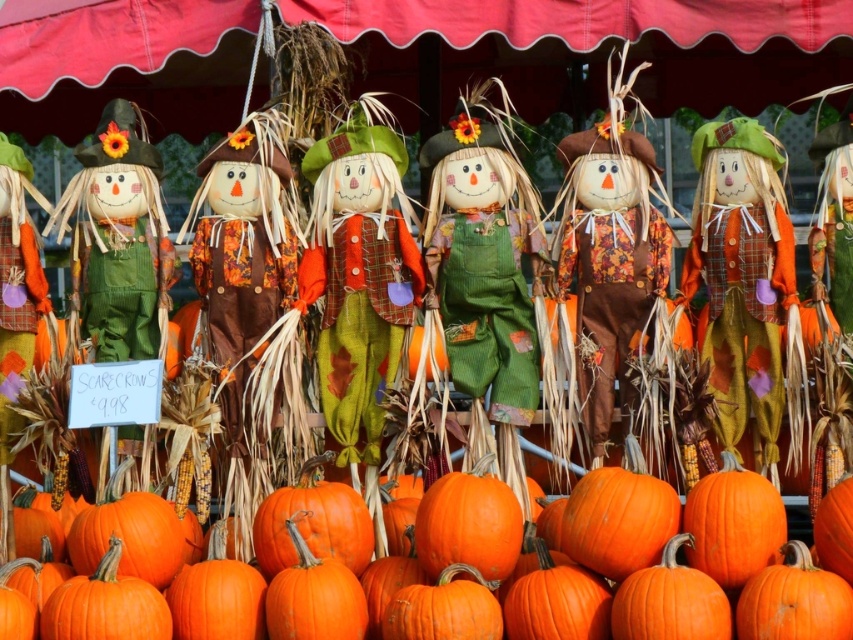
Which is more to the left, green corduroy scarecrow at center or matte orange scarecrow at center?

Positioned to the left is green corduroy scarecrow at center.

In the scene shown: Is green corduroy scarecrow at center bigger than matte orange scarecrow at center?

Indeed, green corduroy scarecrow at center has a larger size compared to matte orange scarecrow at center.

What do you see at coordinates (485, 275) in the screenshot?
I see `green corduroy scarecrow at center` at bounding box center [485, 275].

Identify the location of green corduroy scarecrow at center. The image size is (853, 640). (485, 275).

Is matte brown scarecrow at center thinner than matte green corduroy scarecrow at left?

Incorrect, matte brown scarecrow at center's width is not less than matte green corduroy scarecrow at left's.

Which is in front, point (222, 180) or point (61, 221)?

Point (222, 180) is in front.

Which is behind, point (242, 552) or point (94, 227)?

The point (94, 227) is more distant.

Where is `matte brown scarecrow at center`? The width and height of the screenshot is (853, 640). matte brown scarecrow at center is located at coordinates (242, 280).

Is point (428, 275) in front of point (207, 253)?

Yes, it is.

Which is more to the left, green corduroy scarecrow at center or matte brown scarecrow at center?

matte brown scarecrow at center

What are the coordinates of `green corduroy scarecrow at center` in the screenshot? It's located at (485, 275).

At what (x,y) coordinates should I click in order to perform the action: click on green corduroy scarecrow at center. Please return your answer as a coordinate pair (x, y). This screenshot has height=640, width=853. Looking at the image, I should click on (485, 275).